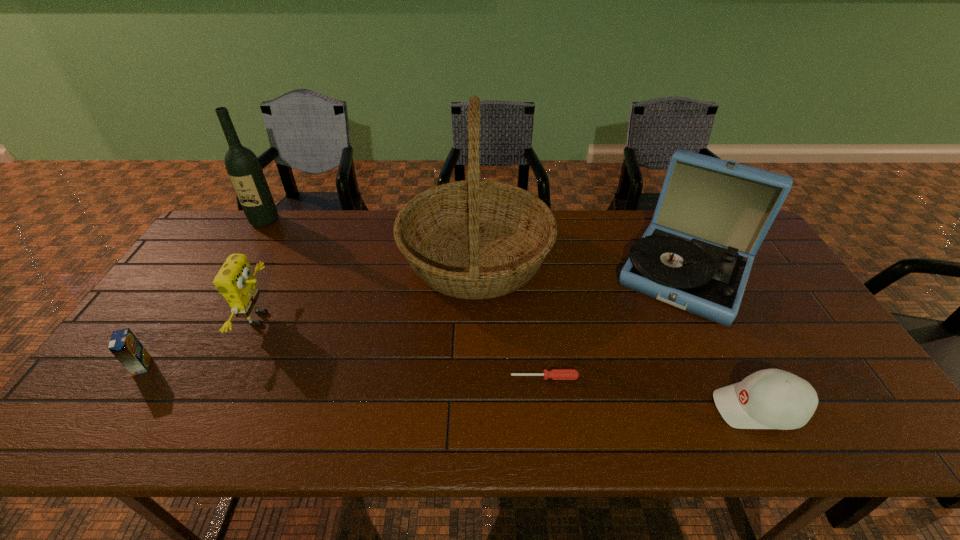
You are a GUI agent. You are given a task and a screenshot of the screen. Output one action in this format:
    pyautogui.click(x=<x>, y=<y>)
    Task: Click on the vacant space at the far left corner
    The height and width of the screenshot is (540, 960).
    Given the screenshot: What is the action you would take?
    pyautogui.click(x=208, y=241)

The height and width of the screenshot is (540, 960). In the image, there is a desktop. Identify the location of vacant space at the near left corner. (137, 415).

I want to click on free space at the near right corner of the desktop, so click(853, 437).

The height and width of the screenshot is (540, 960). Find the location of `vacant space that's between the nearest object and the second tallest object`. vacant space that's between the nearest object and the second tallest object is located at coordinates click(512, 314).

Where is `free space that is in between the shortest object and the wine bottle`? This screenshot has width=960, height=540. free space that is in between the shortest object and the wine bottle is located at coordinates (404, 299).

At what (x,y) coordinates should I click in order to perform the action: click on empty space between the sponge and the basket. Please return your answer as a coordinate pair (x, y). Looking at the image, I should click on (369, 289).

The width and height of the screenshot is (960, 540). In order to click on free area in between the nearest object and the third tallest object in this screenshot , I will do `click(722, 340)`.

The width and height of the screenshot is (960, 540). I want to click on unoccupied position between the fourth shortest object and the sixth object from right to left, so click(263, 270).

Find the location of a particular element. vacant space that's between the wine bottle and the baseball cap is located at coordinates (512, 314).

At what (x,y) coordinates should I click in order to perform the action: click on free point between the fifth object from right to left and the baseball cap. Please return your answer as a coordinate pair (x, y). The image size is (960, 540). Looking at the image, I should click on (510, 363).